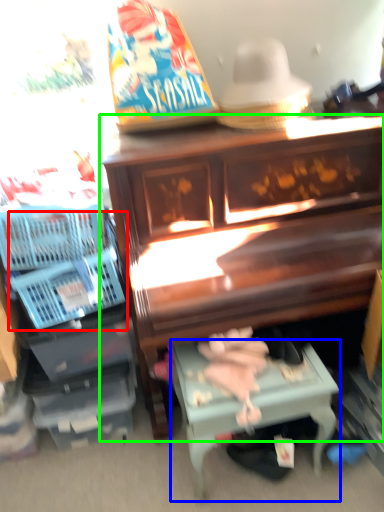
Question: Which object is the farthest from basket (highlighted by a red box)? Choose among these: table (highlighted by a blue box) or furniture (highlighted by a green box).

Choices:
 (A) table
 (B) furniture

Answer: (A)